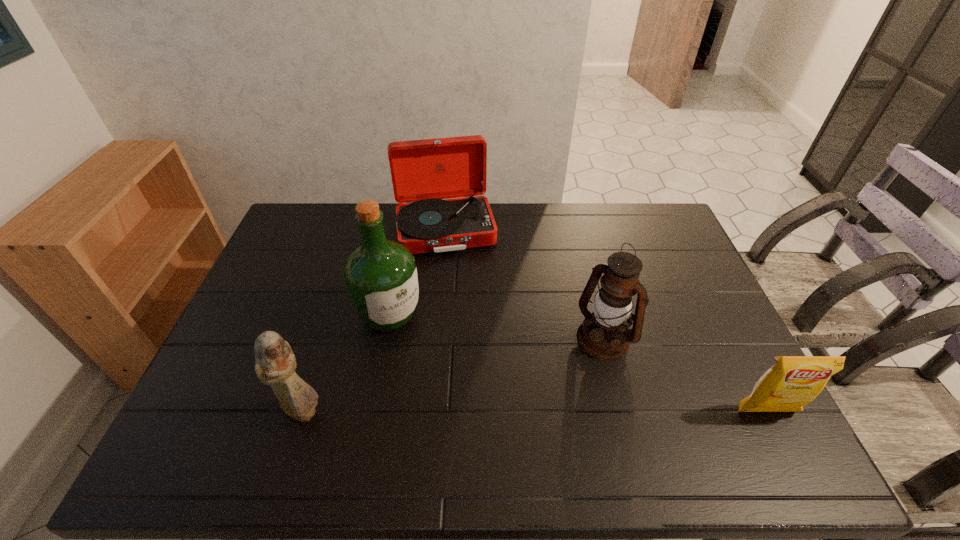
Find the location of a particular element. vacant space that is in between the liquor and the farthest object is located at coordinates (418, 273).

At what (x,y) coordinates should I click in order to perform the action: click on vacant area between the crisp (potato chip) and the lantern. Please return your answer as a coordinate pair (x, y). Image resolution: width=960 pixels, height=540 pixels. Looking at the image, I should click on (685, 375).

Identify which object is the third nearest to the phonograph_record. Please provide its 2D coordinates. Your answer should be formatted as a tuple, i.e. [(x, y)], where the tuple contains the x and y coordinates of a point satisfying the conditions above.

[(275, 365)]

Where is `object that is the third closest to the second object from right to left`? object that is the third closest to the second object from right to left is located at coordinates (380, 275).

Identify the location of blank area in the image that satisfies the following two spatial constraints: 1. on the front side of the lantern; 2. on the right side of the farthest object. (435, 338).